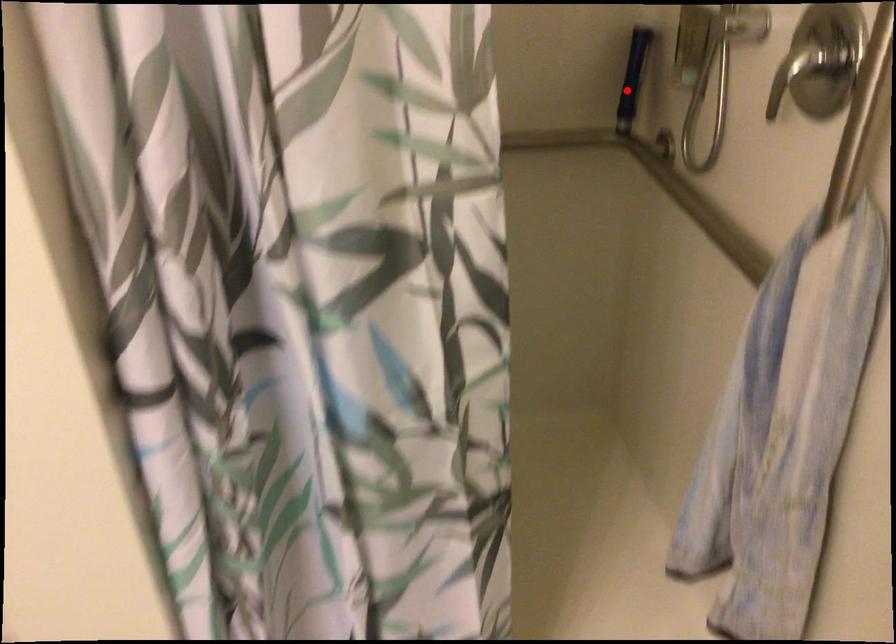
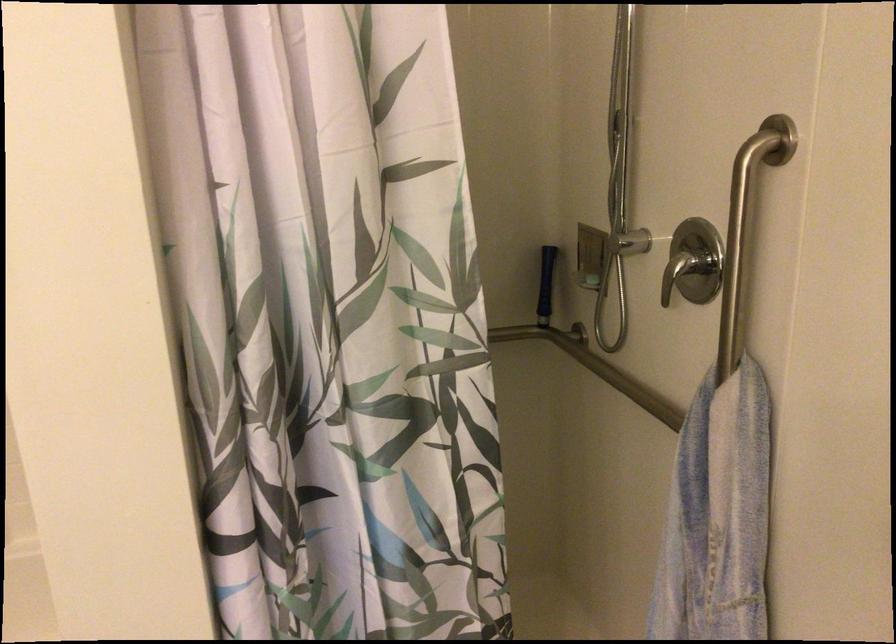
Question: A red point is marked in image1. In image2, is the corresponding 3D point closer to the camera or farther? Reply with the corresponding letter.

Choices:
 (A) The corresponding 3D point is closer.
 (B) The corresponding 3D point is farther.

Answer: (B)